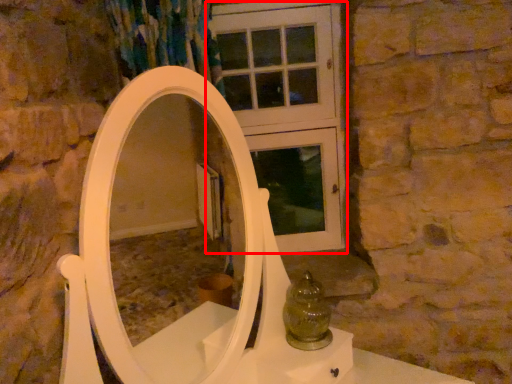
Question: From the image's perspective, what is the correct spatial relationship of screen door (annotated by the red box) in relation to glass vase?

Choices:
 (A) below
 (B) above

Answer: (B)